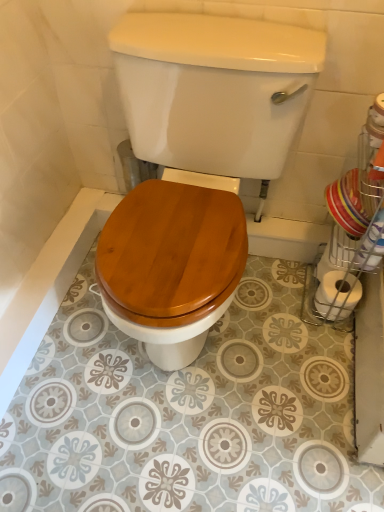
Question: Is white matte toilet paper at right not close to wooden toilet seat at center?

Choices:
 (A) yes
 (B) no

Answer: (B)

Question: Is white matte toilet paper at right positioned beyond the bounds of wooden toilet seat at center?

Choices:
 (A) yes
 (B) no

Answer: (A)

Question: Can you confirm if white matte toilet paper at right is taller than wooden toilet seat at center?

Choices:
 (A) no
 (B) yes

Answer: (A)

Question: Is white matte toilet paper at right closer to camera compared to wooden toilet seat at center?

Choices:
 (A) no
 (B) yes

Answer: (A)

Question: From a real-world perspective, is white matte toilet paper at right positioned under wooden toilet seat at center based on gravity?

Choices:
 (A) yes
 (B) no

Answer: (A)

Question: Can you confirm if white matte toilet paper at right is smaller than wooden toilet seat at center?

Choices:
 (A) no
 (B) yes

Answer: (B)

Question: Is wooden toilet seat at center next to white matte toilet paper at right and touching it?

Choices:
 (A) yes
 (B) no

Answer: (B)

Question: Is wooden toilet seat at center thinner than white matte toilet paper at right?

Choices:
 (A) no
 (B) yes

Answer: (A)

Question: Is wooden toilet seat at center further to the viewer compared to white matte toilet paper at right?

Choices:
 (A) no
 (B) yes

Answer: (A)

Question: From a real-world perspective, is wooden toilet seat at center on top of white matte toilet paper at right?

Choices:
 (A) yes
 (B) no

Answer: (A)

Question: Is wooden toilet seat at center smaller than white matte toilet paper at right?

Choices:
 (A) no
 (B) yes

Answer: (A)

Question: Considering the relative sizes of wooden toilet seat at center and white matte toilet paper at right in the image provided, is wooden toilet seat at center bigger than white matte toilet paper at right?

Choices:
 (A) yes
 (B) no

Answer: (A)

Question: In the image, is white matte toilet paper at right positioned in front of or behind wooden toilet seat at center?

Choices:
 (A) behind
 (B) front

Answer: (A)